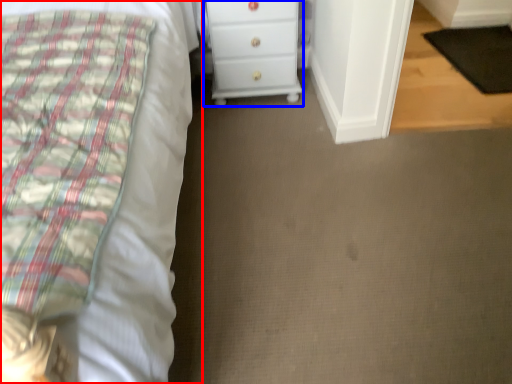
Question: Which object is further to the camera taking this photo, bed (highlighted by a red box) or chest of drawers (highlighted by a blue box)?

Choices:
 (A) bed
 (B) chest of drawers

Answer: (B)